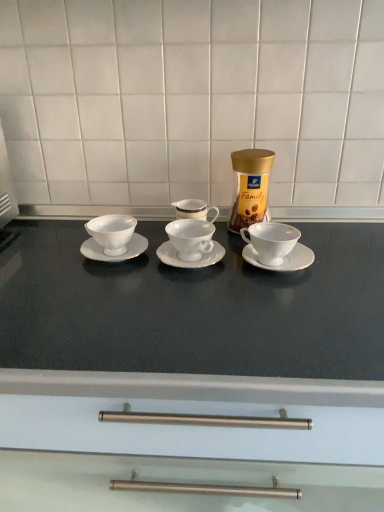
Where is `free point behind white ceramic saucer at right, positioned as the first saucer in right-to-left order`? The width and height of the screenshot is (384, 512). free point behind white ceramic saucer at right, positioned as the first saucer in right-to-left order is located at coordinates (296, 228).